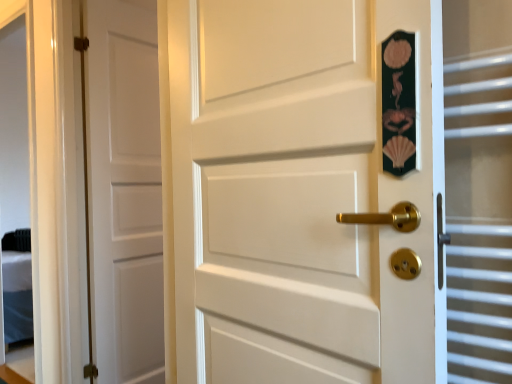
What do you see at coordinates (478, 189) in the screenshot?
I see `clear glass door at right` at bounding box center [478, 189].

The height and width of the screenshot is (384, 512). Identify the location of white matte door at left, which ranks as the first door in back-to-front order. (124, 191).

Is clear glass door at right at the back of white matte door at center, arranged as the second door when viewed from the back?

Yes, white matte door at center, arranged as the second door when viewed from the back, is facing away from clear glass door at right.

From the image's perspective, which is below, white matte door at center, which ranks as the first door in front-to-back order, or clear glass door at right?

clear glass door at right appears lower in the image.

Based on the photo, in terms of size, does white matte door at center, arranged as the second door when viewed from the back, appear bigger or smaller than clear glass door at right?

In the image, white matte door at center, arranged as the second door when viewed from the back, appears to be larger than clear glass door at right.

Which object is thinner, white matte door at center, arranged as the second door when viewed from the back, or clear glass door at right?

clear glass door at right.

From the image's perspective, is white matte door at left, which is counted as the 1th door, starting from the left, above or below clear glass door at right?

white matte door at left, which is counted as the 1th door, starting from the left, is situated higher than clear glass door at right in the image.

Can you confirm if white matte door at left, which is the 2th door from right to left, is smaller than clear glass door at right?

No.

Can you confirm if white matte door at left, which is counted as the 1th door, starting from the left, is taller than clear glass door at right?

Indeed, white matte door at left, which is counted as the 1th door, starting from the left, has a greater height compared to clear glass door at right.

Considering the points (159, 262) and (502, 170), which point is in front, point (159, 262) or point (502, 170)?

The point (502, 170) is closer.

Where is `glass door in front of the white matte door at left, which is the 2th door from right to left`? The image size is (512, 384). glass door in front of the white matte door at left, which is the 2th door from right to left is located at coordinates (478, 189).

Is clear glass door at right inside or outside of white matte door at left, which is the 2th door from right to left?

clear glass door at right cannot be found inside white matte door at left, which is the 2th door from right to left.

Is clear glass door at right positioned far away from white matte door at left, which ranks as the second door in front-to-back order?

That's right, there is a large distance between clear glass door at right and white matte door at left, which ranks as the second door in front-to-back order.

Does white matte door at left, which is counted as the 1th door, starting from the left, have a greater height compared to white matte door at center, arranged as the second door when viewed from the back?

Yes.

Is white matte door at center, which ranks as the first door in front-to-back order, at the back of white matte door at left, which is counted as the 1th door, starting from the left?

No, white matte door at left, which is counted as the 1th door, starting from the left, is not facing away from white matte door at center, which ranks as the first door in front-to-back order.

Is point (121, 280) closer to camera compared to point (232, 359)?

That is False.

Can you tell me how much clear glass door at right and white matte door at center, the 1th door when ordered from right to left, differ in facing direction?

The facing directions of clear glass door at right and white matte door at center, the 1th door when ordered from right to left, are 6.4 degrees apart.

Between clear glass door at right and white matte door at center, the 1th door when ordered from right to left, which one has smaller size?

clear glass door at right is smaller.

Which is more to the left, clear glass door at right or white matte door at center, the 2th door positioned from the left?

white matte door at center, the 2th door positioned from the left.

Is clear glass door at right far away from white matte door at center, the 2th door positioned from the left?

No, clear glass door at right is not far away from white matte door at center, the 2th door positioned from the left.

Is white matte door at center, arranged as the second door when viewed from the back, surrounding white matte door at left, which is the 2th door from right to left?

That's incorrect, white matte door at left, which is the 2th door from right to left, is not inside white matte door at center, arranged as the second door when viewed from the back.

Could you tell me if white matte door at center, the 1th door when ordered from right to left, is facing white matte door at left, which ranks as the first door in back-to-front order?

No, white matte door at center, the 1th door when ordered from right to left, is not facing towards white matte door at left, which ranks as the first door in back-to-front order.

From the image's perspective, would you say white matte door at center, arranged as the second door when viewed from the back, is positioned over white matte door at left, which is counted as the 1th door, starting from the left?

Yes, from the image's perspective, white matte door at center, arranged as the second door when viewed from the back, is on top of white matte door at left, which is counted as the 1th door, starting from the left.

Locate an element on the screen. This screenshot has height=384, width=512. glass door lying below the white matte door at center, the 1th door when ordered from right to left (from the image's perspective) is located at coordinates (478, 189).

This screenshot has width=512, height=384. In order to click on glass door located in front of the white matte door at left, which ranks as the first door in back-to-front order in this screenshot , I will do `click(478, 189)`.

Which object lies nearer to the anchor point white matte door at left, which is the 2th door from right to left, white matte door at center, which ranks as the first door in front-to-back order, or clear glass door at right?

white matte door at center, which ranks as the first door in front-to-back order, lies closer to white matte door at left, which is the 2th door from right to left, than the other object.

When comparing their distances from white matte door at center, the 1th door when ordered from right to left, does white matte door at left, which is the 2th door from right to left, or clear glass door at right seem further?

white matte door at left, which is the 2th door from right to left, is further to white matte door at center, the 1th door when ordered from right to left.

Considering their positions, is clear glass door at right positioned further to white matte door at left, which ranks as the first door in back-to-front order, than white matte door at center, which ranks as the first door in front-to-back order?

clear glass door at right is positioned further to the anchor white matte door at left, which ranks as the first door in back-to-front order.

Based on their spatial positions, is clear glass door at right or white matte door at left, which is counted as the 1th door, starting from the left, further from white matte door at center, the 2th door positioned from the left?

white matte door at left, which is counted as the 1th door, starting from the left, lies further to white matte door at center, the 2th door positioned from the left, than the other object.

Based on their spatial positions, is white matte door at center, the 2th door positioned from the left, or white matte door at left, which is the 2th door from right to left, further from clear glass door at right?

Based on the image, white matte door at left, which is the 2th door from right to left, appears to be further to clear glass door at right.

Looking at the image, which one is located closer to clear glass door at right, white matte door at left, which is the 2th door from right to left, or white matte door at center, the 1th door when ordered from right to left?

white matte door at center, the 1th door when ordered from right to left, is positioned closer to the anchor clear glass door at right.

Identify the location of glass door positioned between white matte door at center, arranged as the second door when viewed from the back, and white matte door at left, which ranks as the first door in back-to-front order, from near to far. (478, 189).